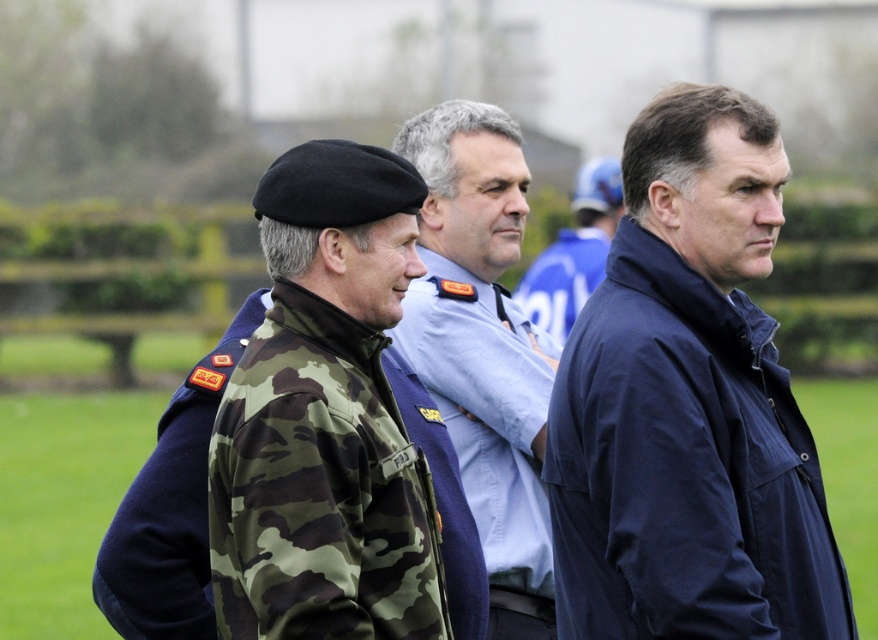
Question: Which of these objects is positioned farthest from the camo fabric jacket at center?

Choices:
 (A) camouflage fabric jacket at center
 (B) navy blue jacket at right
 (C) dark blue jacket at center

Answer: (C)

Question: Which of the following is the closest to the observer?

Choices:
 (A) (574, 294)
 (B) (163, 470)

Answer: (B)

Question: Is camouflage fabric jacket at center behind dark blue jacket at center?

Choices:
 (A) yes
 (B) no

Answer: (B)

Question: Is navy blue jacket at right bigger than dark blue jacket at center?

Choices:
 (A) no
 (B) yes

Answer: (A)

Question: Does camo fabric jacket at center have a smaller size compared to dark blue jacket at center?

Choices:
 (A) yes
 (B) no

Answer: (A)

Question: Which object is the farthest from the navy blue jacket at right?

Choices:
 (A) dark blue jacket at center
 (B) camouflage fabric jacket at center

Answer: (A)